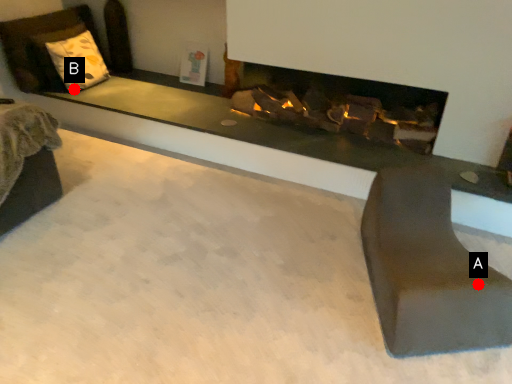
Question: Two points are circled on the image, labeled by A and B beside each circle. Which of the following is the farthest from the observer?

Choices:
 (A) A is further
 (B) B is further

Answer: (B)